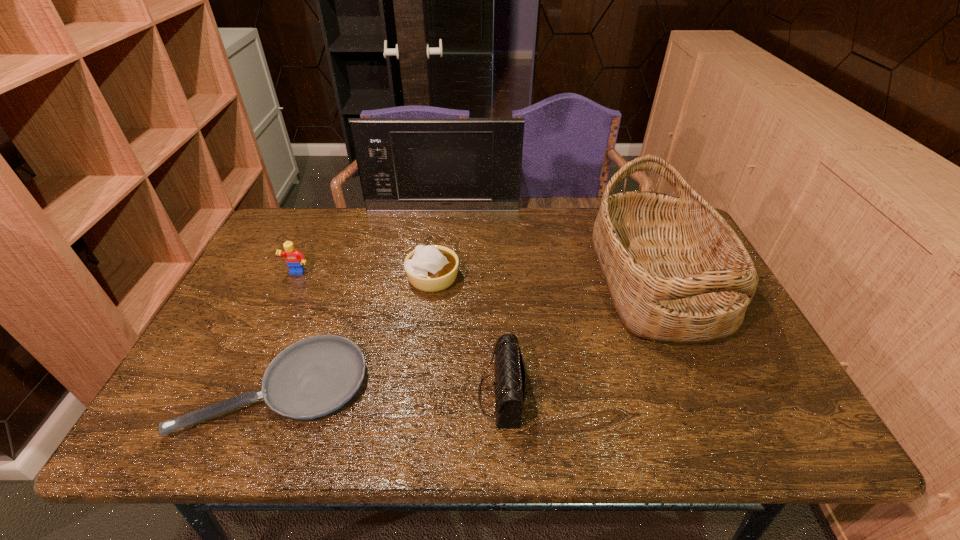
Where is `object that is the fifth closest to the basket`? This screenshot has height=540, width=960. object that is the fifth closest to the basket is located at coordinates (294, 259).

Where is `free space that satisfies the following two spatial constraints: 1. on the face of the whipped cream; 2. on the right side of the Lego`? The image size is (960, 540). free space that satisfies the following two spatial constraints: 1. on the face of the whipped cream; 2. on the right side of the Lego is located at coordinates (296, 279).

Find the location of a particular element. This screenshot has width=960, height=540. vacant space that satisfies the following two spatial constraints: 1. on the face of the Lego; 2. on the left side of the frying pan is located at coordinates (245, 388).

Image resolution: width=960 pixels, height=540 pixels. In order to click on vacant region that satisfies the following two spatial constraints: 1. on the front panel of the second tallest object; 2. on the left side of the microwave oven in this screenshot , I will do `click(435, 281)`.